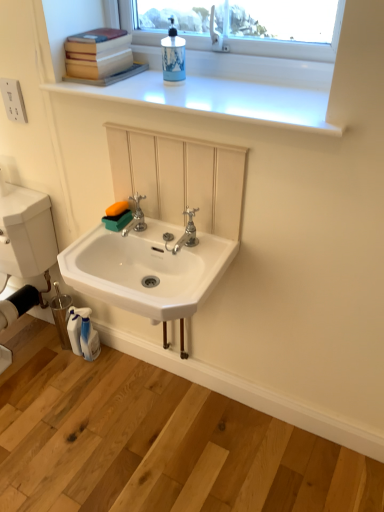
This screenshot has width=384, height=512. What are the coordinates of `vacant space in front of blue ceramic soap dispenser at upper center` in the screenshot? It's located at (177, 96).